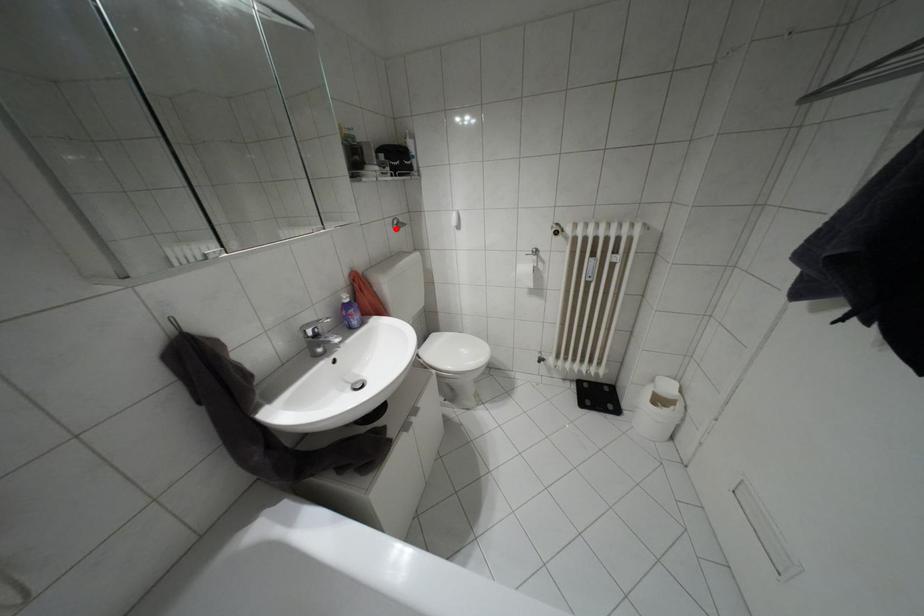
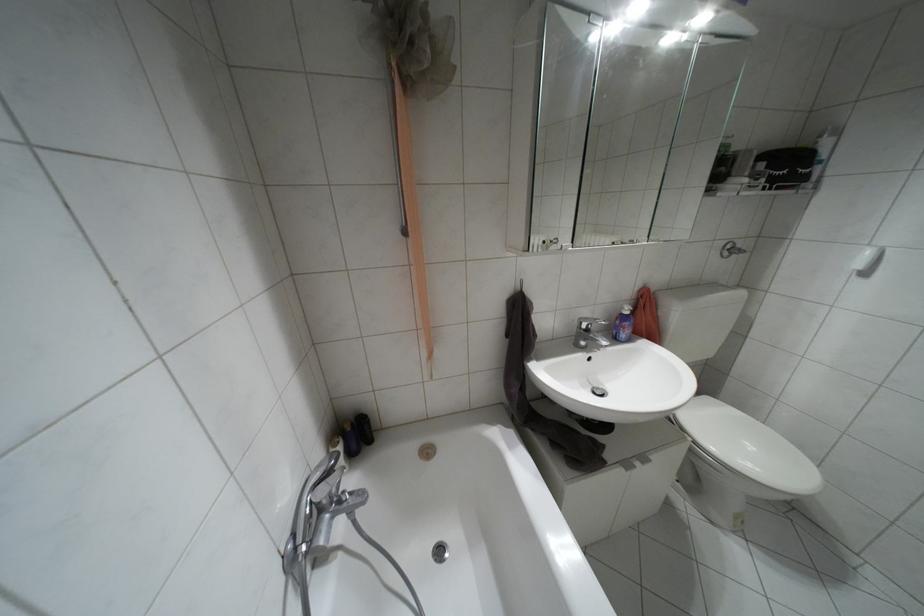
The point at the highlighted location is marked in the first image. Where is the corresponding point in the second image?

(723, 254)